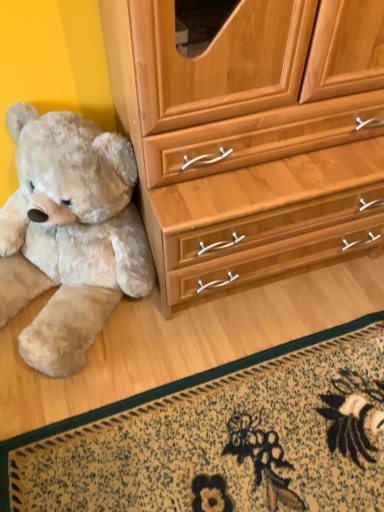
Image resolution: width=384 pixels, height=512 pixels. In order to click on floral carpet at lower center in this screenshot , I will do `click(223, 438)`.

This screenshot has height=512, width=384. Describe the element at coordinates (223, 438) in the screenshot. I see `floral carpet at lower center` at that location.

The height and width of the screenshot is (512, 384). Describe the element at coordinates (69, 234) in the screenshot. I see `fluffy beige teddy bear at left` at that location.

What are the coordinates of `fluffy beige teddy bear at left` in the screenshot? It's located at (69, 234).

The height and width of the screenshot is (512, 384). Find the location of `floral carpet at lower center`. floral carpet at lower center is located at coordinates (223, 438).

Considering the relative positions of floral carpet at lower center and fluffy beige teddy bear at left in the image provided, is floral carpet at lower center to the left of fluffy beige teddy bear at left from the viewer's perspective?

Incorrect, floral carpet at lower center is not on the left side of fluffy beige teddy bear at left.

Considering the positions of objects floral carpet at lower center and fluffy beige teddy bear at left in the image provided, who is behind, floral carpet at lower center or fluffy beige teddy bear at left?

floral carpet at lower center is further from the camera.

Is point (161, 474) closer to viewer compared to point (119, 212)?

That is True.

Consider the image. From the image's perspective, is floral carpet at lower center above fluffy beige teddy bear at left?

No.

From a real-world perspective, is floral carpet at lower center positioned over fluffy beige teddy bear at left based on gravity?

No, from a real-world perspective, floral carpet at lower center is not over fluffy beige teddy bear at left

Considering the sizes of objects floral carpet at lower center and fluffy beige teddy bear at left in the image provided, who is wider, floral carpet at lower center or fluffy beige teddy bear at left?

fluffy beige teddy bear at left.

Is floral carpet at lower center taller than fluffy beige teddy bear at left?

No, floral carpet at lower center is not taller than fluffy beige teddy bear at left.

From the picture: Between floral carpet at lower center and fluffy beige teddy bear at left, which one has larger size?

fluffy beige teddy bear at left.

Based on the photo, is floral carpet at lower center inside or outside of fluffy beige teddy bear at left?

floral carpet at lower center is spatially situated outside fluffy beige teddy bear at left.

Is floral carpet at lower center touching fluffy beige teddy bear at left?

floral carpet at lower center is not next to fluffy beige teddy bear at left, and they're not touching.

Consider the image. Is fluffy beige teddy bear at left at the back of floral carpet at lower center?

No, fluffy beige teddy bear at left is not at the back of floral carpet at lower center.

How many degrees apart are the facing directions of floral carpet at lower center and fluffy beige teddy bear at left?

180 degrees.

How far apart are floral carpet at lower center and fluffy beige teddy bear at left?

floral carpet at lower center and fluffy beige teddy bear at left are 19.02 inches apart from each other.

The height and width of the screenshot is (512, 384). What are the coordinates of `doormat on the right of fluffy beige teddy bear at left` in the screenshot? It's located at (223, 438).

Is fluffy beige teddy bear at left to the left of floral carpet at lower center from the viewer's perspective?

Correct, you'll find fluffy beige teddy bear at left to the left of floral carpet at lower center.

Which object is further away from the camera taking this photo, fluffy beige teddy bear at left or floral carpet at lower center?

floral carpet at lower center is behind.

Does point (59, 112) come farther from viewer compared to point (175, 407)?

No, (59, 112) is in front of (175, 407).

From the image's perspective, is fluffy beige teddy bear at left beneath floral carpet at lower center?

Actually, fluffy beige teddy bear at left appears above floral carpet at lower center in the image.

From a real-world perspective, which object rests below the other?

In real-world perspective, floral carpet at lower center is lower.

Considering the relative sizes of fluffy beige teddy bear at left and floral carpet at lower center in the image provided, is fluffy beige teddy bear at left thinner than floral carpet at lower center?

Incorrect, the width of fluffy beige teddy bear at left is not less than that of floral carpet at lower center.

From the picture: Who is shorter, fluffy beige teddy bear at left or floral carpet at lower center?

floral carpet at lower center.

Considering the sizes of fluffy beige teddy bear at left and floral carpet at lower center in the image, is fluffy beige teddy bear at left bigger or smaller than floral carpet at lower center?

In the image, fluffy beige teddy bear at left appears to be larger than floral carpet at lower center.

Is fluffy beige teddy bear at left outside of floral carpet at lower center?

Absolutely, fluffy beige teddy bear at left is external to floral carpet at lower center.

Are fluffy beige teddy bear at left and floral carpet at lower center located far from each other?

No, there isn't a large distance between fluffy beige teddy bear at left and floral carpet at lower center.

Is fluffy beige teddy bear at left oriented towards floral carpet at lower center?

Yes, fluffy beige teddy bear at left is turned towards floral carpet at lower center.

In the scene shown: How different are the orientations of fluffy beige teddy bear at left and floral carpet at lower center in degrees?

fluffy beige teddy bear at left and floral carpet at lower center are facing 180 degrees away from each other.

Measure the distance between fluffy beige teddy bear at left and floral carpet at lower center.

A distance of 19.02 inches exists between fluffy beige teddy bear at left and floral carpet at lower center.

The width and height of the screenshot is (384, 512). What are the coordinates of `doormat located on the right of fluffy beige teddy bear at left` in the screenshot? It's located at (223, 438).

You are a GUI agent. You are given a task and a screenshot of the screen. Output one action in this format:
    pyautogui.click(x=<x>, y=<y>)
    Task: Click on the doormat that appears on the right of fluffy beige teddy bear at left
    The height and width of the screenshot is (512, 384).
    Given the screenshot: What is the action you would take?
    pyautogui.click(x=223, y=438)

Locate an element on the screen. The width and height of the screenshot is (384, 512). doormat below the fluffy beige teddy bear at left (from the image's perspective) is located at coordinates (223, 438).